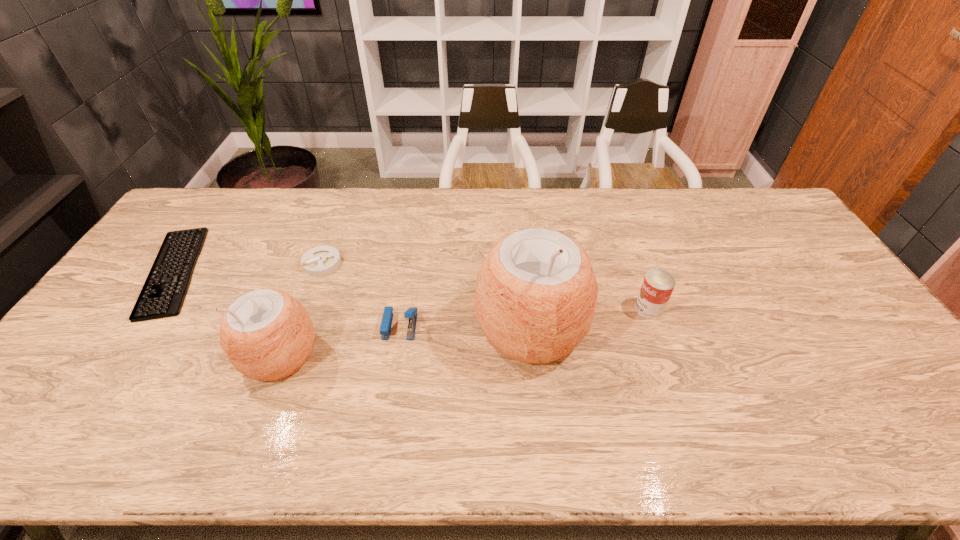
At what (x,y) coordinates should I click in order to perform the action: click on object present at the left edge. Please return your answer as a coordinate pair (x, y). Image resolution: width=960 pixels, height=540 pixels. Looking at the image, I should click on (164, 298).

Identify the location of free space at the far edge of the desktop. The width and height of the screenshot is (960, 540). (447, 217).

Where is `vacant area at the near edge`? The height and width of the screenshot is (540, 960). vacant area at the near edge is located at coordinates click(x=396, y=388).

Locate an element on the screen. Image resolution: width=960 pixels, height=540 pixels. vacant space at the left edge of the desktop is located at coordinates (92, 366).

The image size is (960, 540). I want to click on vacant space at the far left corner, so click(x=177, y=220).

In the image, there is a desktop. Where is `free space at the far right corner`? This screenshot has width=960, height=540. free space at the far right corner is located at coordinates (739, 188).

Where is `empty space between the ashtray and the stapler`? empty space between the ashtray and the stapler is located at coordinates [x=361, y=294].

This screenshot has width=960, height=540. What are the coordinates of `vacant region between the fifth object from left to right and the fourth tallest object` in the screenshot? It's located at [x=466, y=327].

This screenshot has width=960, height=540. Identify the location of vacant space in between the left coconut and the can. (465, 332).

Locate an element on the screen. The height and width of the screenshot is (540, 960). vacant space in between the tallest object and the shortest object is located at coordinates (352, 300).